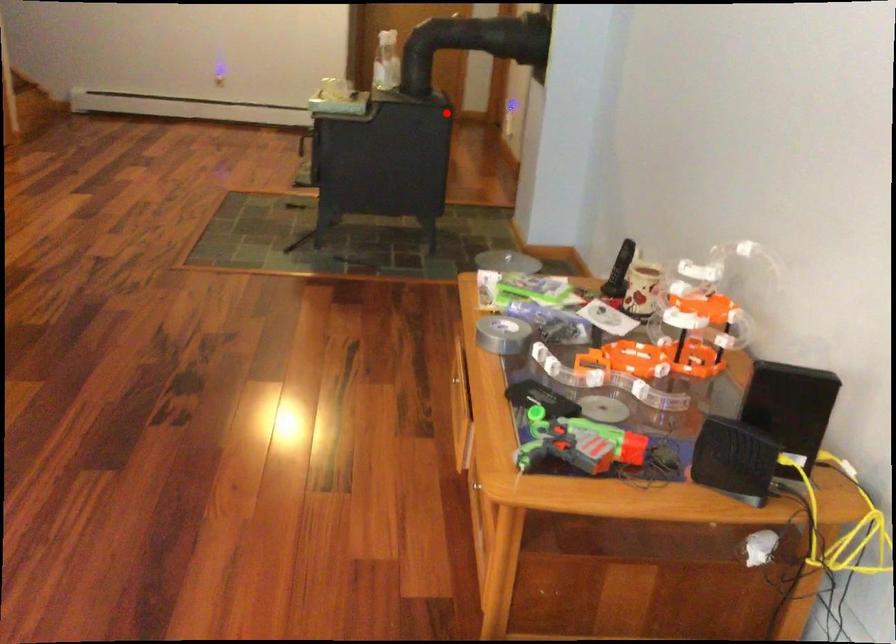
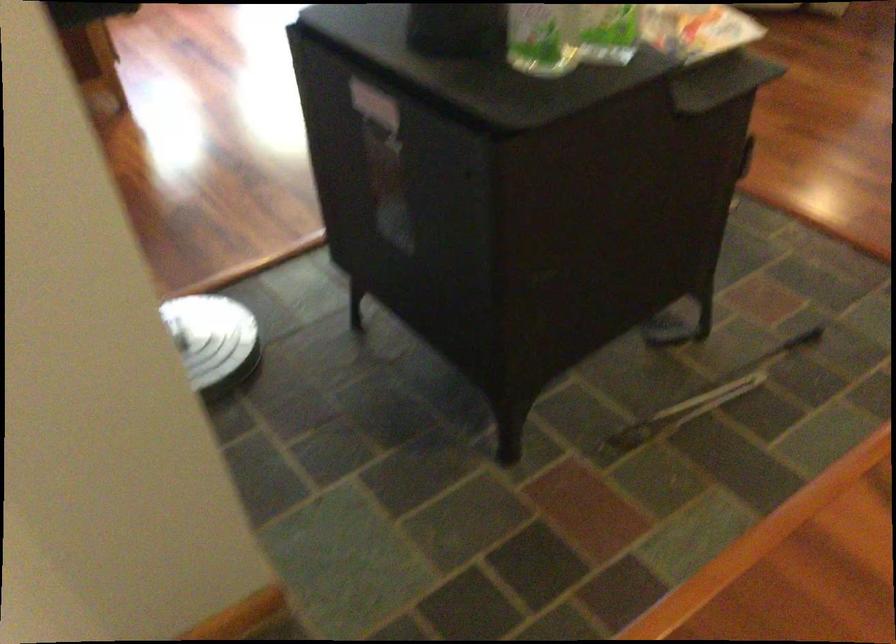
Find the pixel in the second image that matches the highlighted location in the first image.

(375, 104)